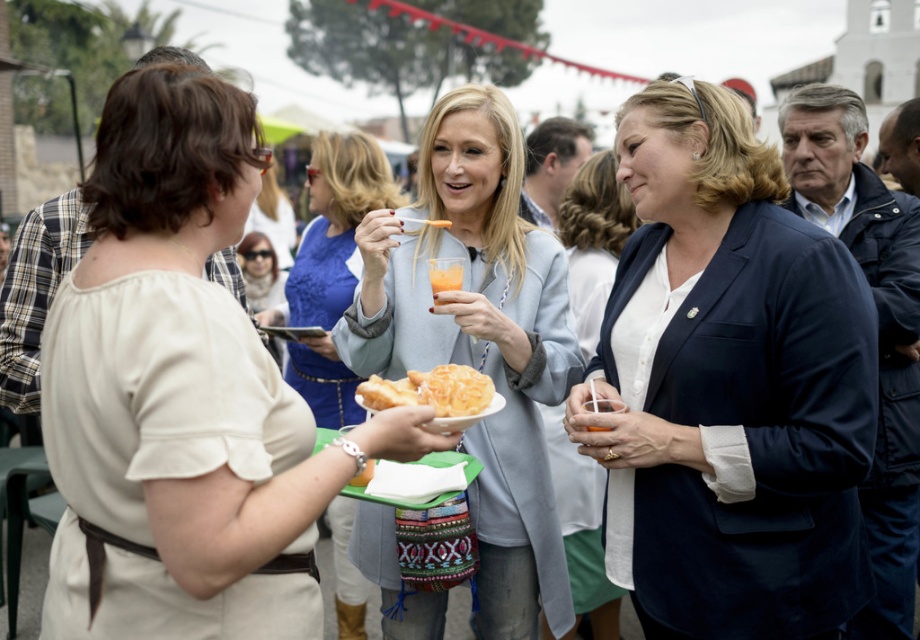
Does matte beige blouse at center appear over golden crispy pastry at center?

Indeed, matte beige blouse at center is positioned over golden crispy pastry at center.

Which is behind, point (128, 611) or point (375, 396)?

The point (375, 396) is behind.

You are a GUI agent. You are given a task and a screenshot of the screen. Output one action in this format:
    pyautogui.click(x=<x>, y=<y>)
    Task: Click on the matte beige blouse at center
    
    Given the screenshot: What is the action you would take?
    pyautogui.click(x=181, y=394)

Describe the element at coordinates (332, 268) in the screenshot. The height and width of the screenshot is (640, 920). I see `blue lace dress at center` at that location.

Who is more forward, (283, 314) or (443, 257)?

Point (443, 257) is in front.

You are a GUI agent. You are given a task and a screenshot of the screen. Output one action in this format:
    pyautogui.click(x=<x>, y=<y>)
    Task: Click on the blue lace dress at center
    Image resolution: width=920 pixels, height=640 pixels.
    Given the screenshot: What is the action you would take?
    pyautogui.click(x=332, y=268)

Between point (600, 625) and point (362, 387), which one is positioned behind?

Point (600, 625)

Is white matte blazer at center below golden crispy pastry at center?

No.

Is point (625, 225) positioned behind point (398, 392)?

Yes, it is behind point (398, 392).

The image size is (920, 640). Find the location of `white matte blazer at center`. white matte blazer at center is located at coordinates (593, 241).